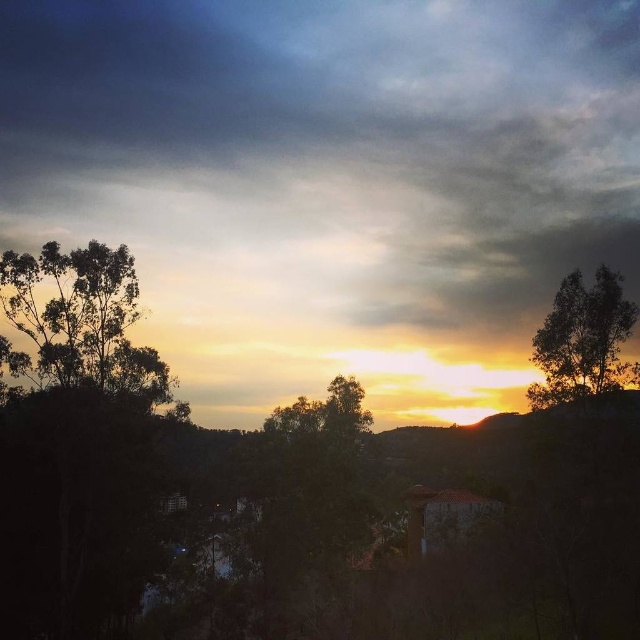
Question: Does green leafy tree at left appear on the right side of silhouette leafy tree at upper right?

Choices:
 (A) yes
 (B) no

Answer: (B)

Question: Among these points, which one is nearest to the camera?

Choices:
 (A) (67, 365)
 (B) (625, 317)

Answer: (A)

Question: Among these points, which one is nearest to the camera?

Choices:
 (A) (636, 308)
 (B) (33, 339)

Answer: (B)

Question: Can you confirm if green leafy tree at left is positioned to the right of silhouette leafy tree at upper right?

Choices:
 (A) yes
 (B) no

Answer: (B)

Question: Does green leafy tree at left appear on the left side of silhouette leafy tree at upper right?

Choices:
 (A) yes
 (B) no

Answer: (A)

Question: Which point is farther to the camera?

Choices:
 (A) (1, 253)
 (B) (627, 364)

Answer: (B)